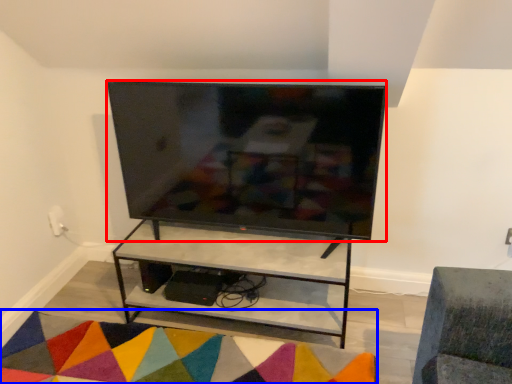
Question: Which point is further to the camera, television (highlighted by a red box) or mat (highlighted by a blue box)?

Choices:
 (A) television
 (B) mat

Answer: (A)